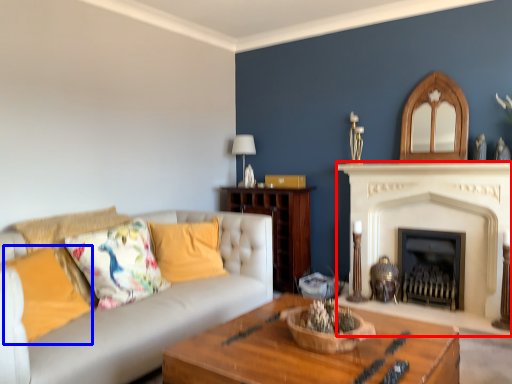
Question: Which object is closer to the camera taking this photo, fireplace (highlighted by a red box) or pillow (highlighted by a blue box)?

Choices:
 (A) fireplace
 (B) pillow

Answer: (B)